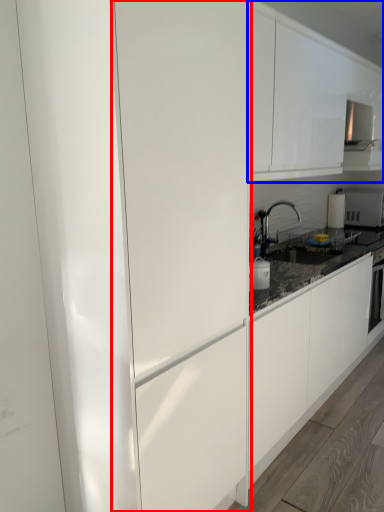
Question: Which of the following is the closest to the observer, glass door (highlighted by a red box) or cabinetry (highlighted by a blue box)?

Choices:
 (A) glass door
 (B) cabinetry

Answer: (A)